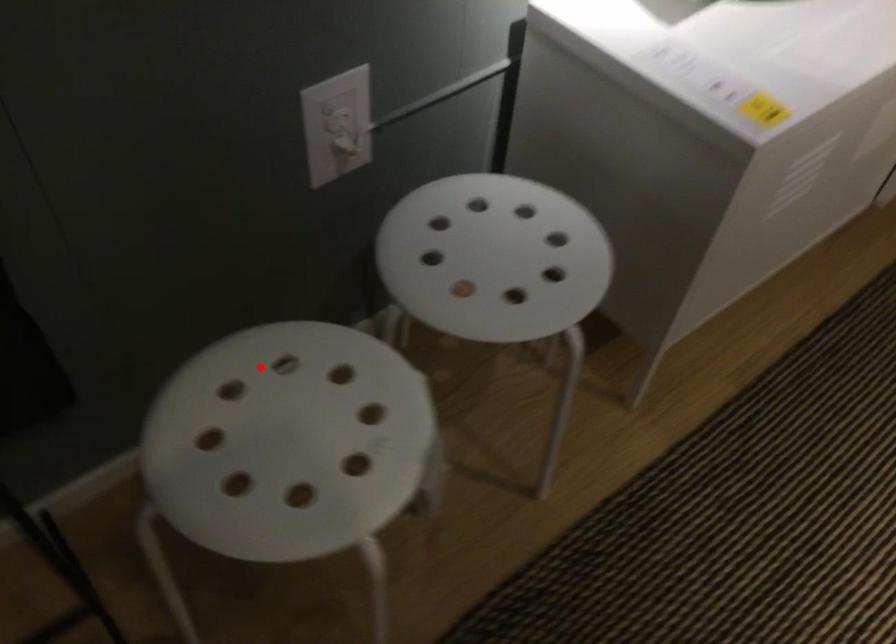
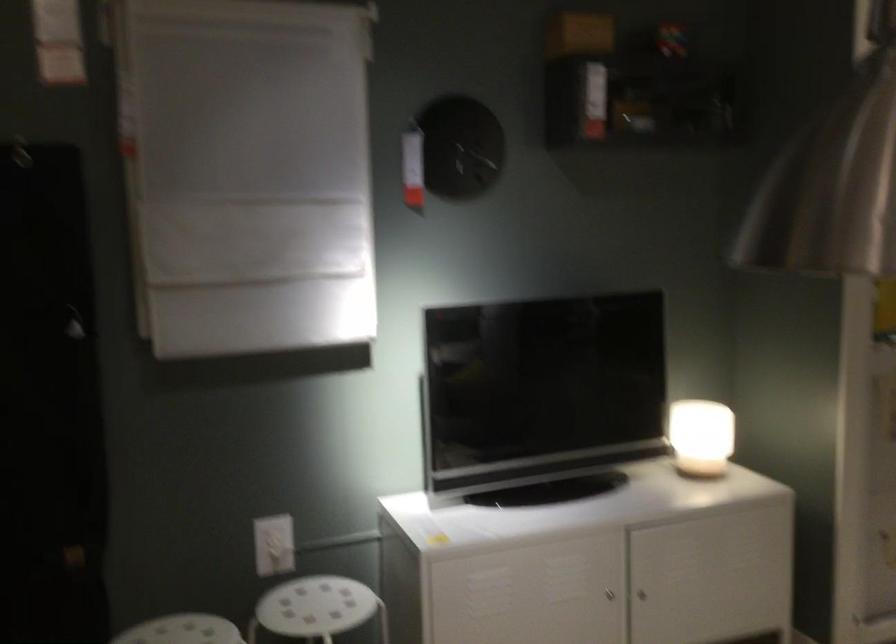
Question: I am providing you with two images of the same scene from different viewpoints. A red point is shown in image1. For the corresponding object point in image2, is it positioned nearer or farther from the camera?

Choices:
 (A) Nearer
 (B) Farther

Answer: (B)